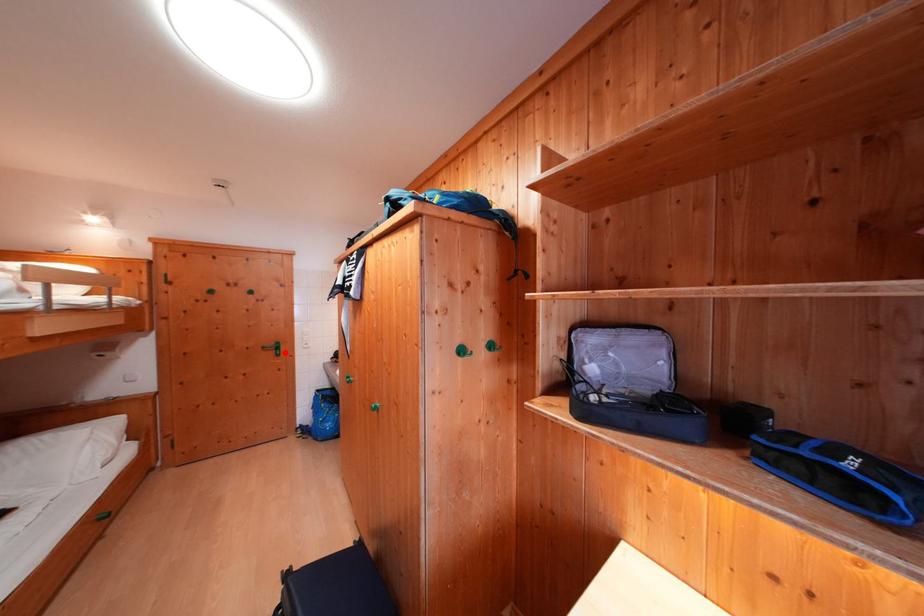
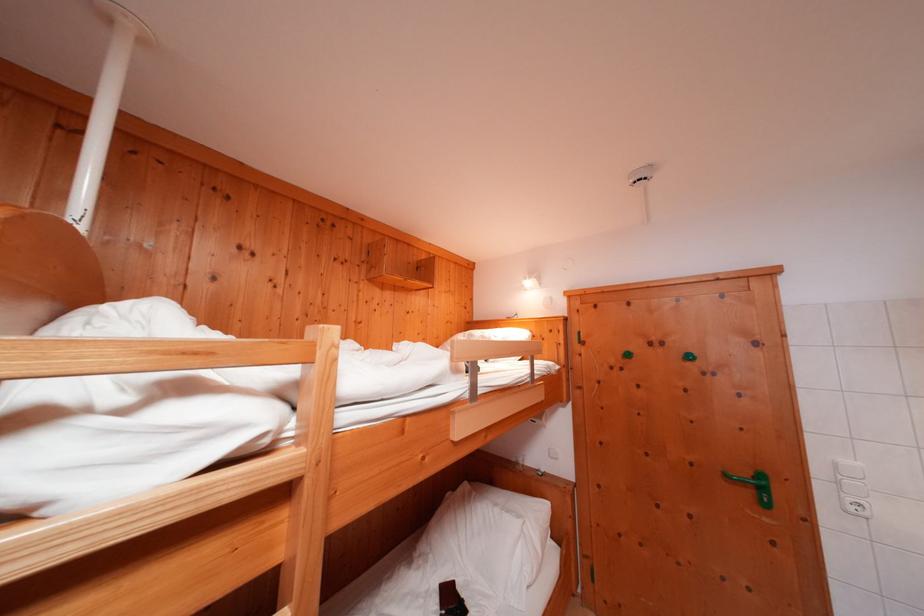
Locate, in the second image, the point that corresponds to the highlighted location in the first image.

(771, 493)